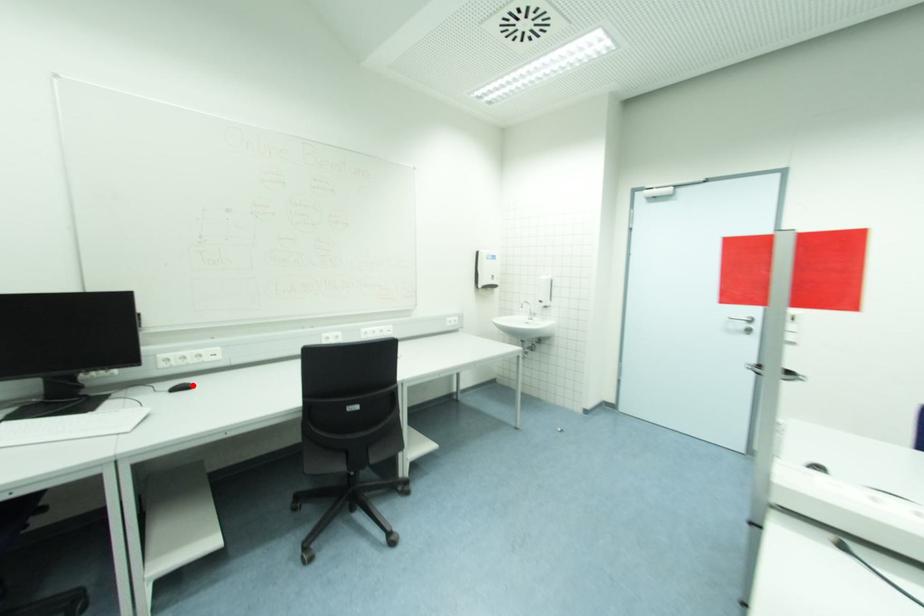
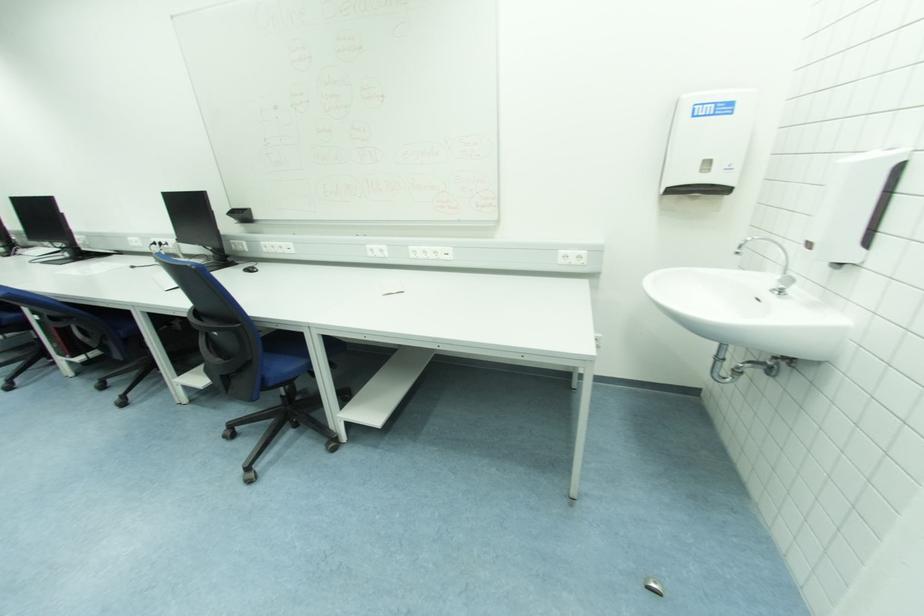
In the second image, find the point that corresponds to the highlighted location in the first image.

(257, 270)